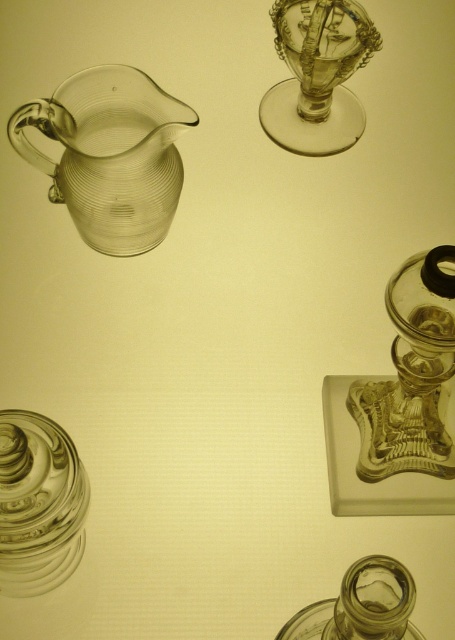
Question: Does transparent glass jug at upper left appear under transparent glass jar at bottom?

Choices:
 (A) no
 (B) yes

Answer: (A)

Question: Which point is farther from the camera taking this photo?

Choices:
 (A) (369, 586)
 (B) (353, 19)
 (C) (36, 582)
 (D) (107, 115)

Answer: (B)

Question: Is clear glass jar at lower left smaller than transparent glass jar at bottom?

Choices:
 (A) no
 (B) yes

Answer: (A)

Question: Which point is closer to the camera?

Choices:
 (A) (41, 432)
 (B) (334, 627)

Answer: (B)

Question: Does transparent glass jug at upper left have a greater width compared to clear glass jar at lower left?

Choices:
 (A) no
 (B) yes

Answer: (B)

Question: Estimate the real-world distances between objects in this image. Which object is farther from the transparent glass jug at upper left?

Choices:
 (A) transparent glass jar at bottom
 (B) transparent glass wine glass at upper center
 (C) clear glass jar at lower left

Answer: (A)